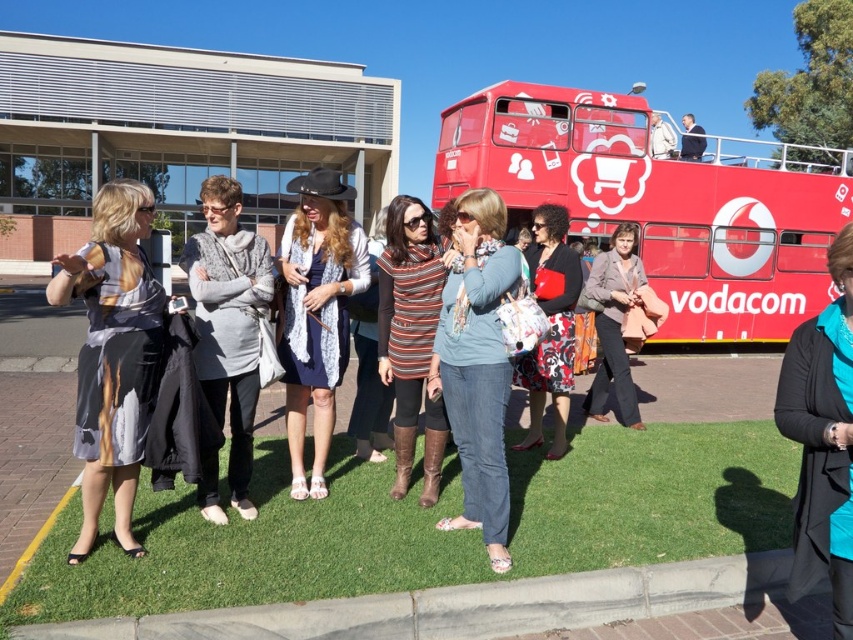
You are a photographer taking a picture of the group. You notice the denim jeans at center and the gray wool sweater at center. Which clothing item is more to the right in the photo?

The denim jeans at center is positioned on the right side of gray wool sweater at center, so the denim jeans at center is more to the right.

You are a photographer standing at the edge of the green grass at lower center, and you want to take a photo of the denim jeans at center. Which direction should you move to get a better shot?

The green grass at lower center is positioned on the right side of denim jeans at center. To get a better shot of the denim jeans at center, you should move to the left to align yourself with the denim jeans at center.